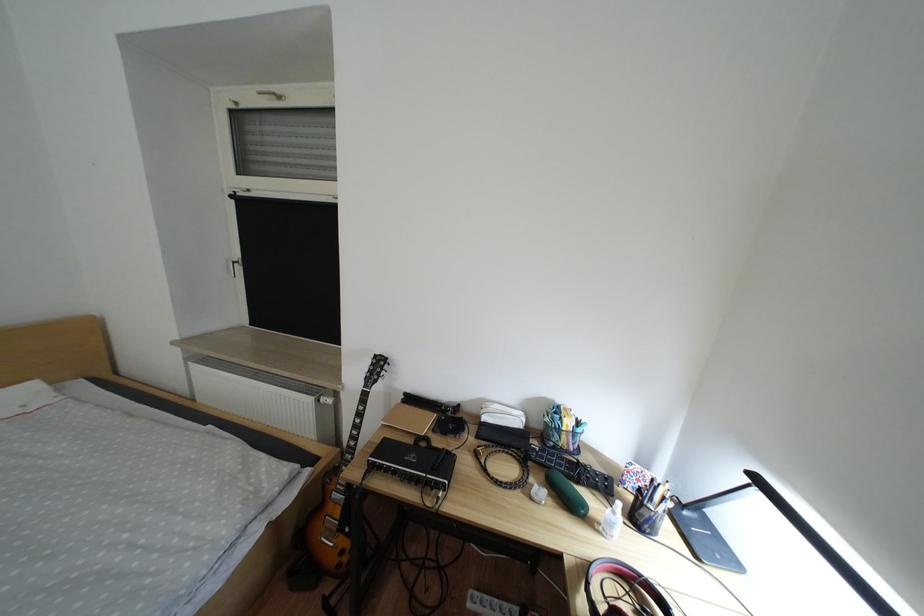
Find where to pull the white window handle. Please return your answer as a coordinate pair (x, y).

(271, 95)